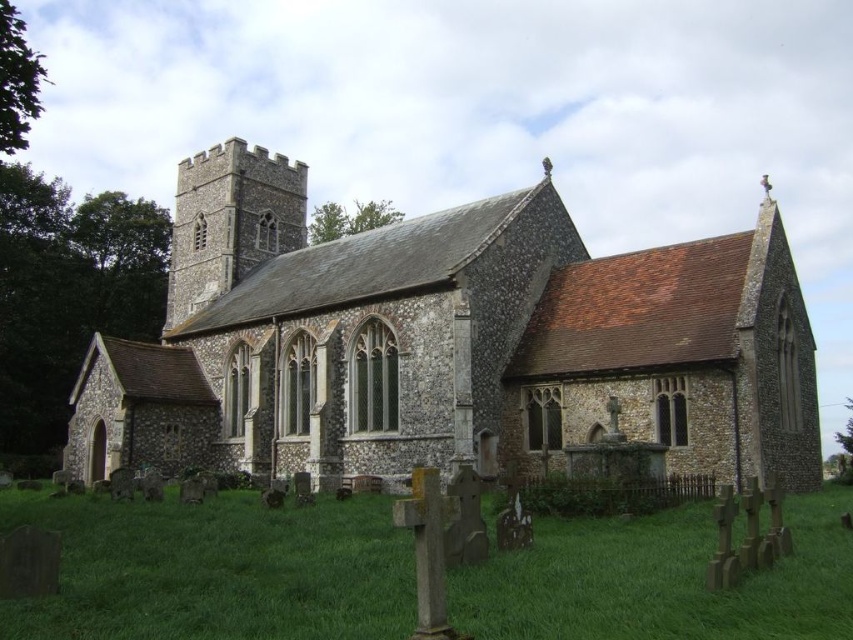
Question: Does stone church at center have a greater width compared to green grass at lower center?

Choices:
 (A) no
 (B) yes

Answer: (B)

Question: Which point is farther to the camera?

Choices:
 (A) stone church at center
 (B) green grass at lower center

Answer: (A)

Question: Is stone church at center positioned before green grass at lower center?

Choices:
 (A) no
 (B) yes

Answer: (A)

Question: Which point is farther from the camera taking this photo?

Choices:
 (A) (177, 586)
 (B) (259, 456)

Answer: (B)

Question: Is stone church at center positioned at the back of green grass at lower center?

Choices:
 (A) no
 (B) yes

Answer: (B)